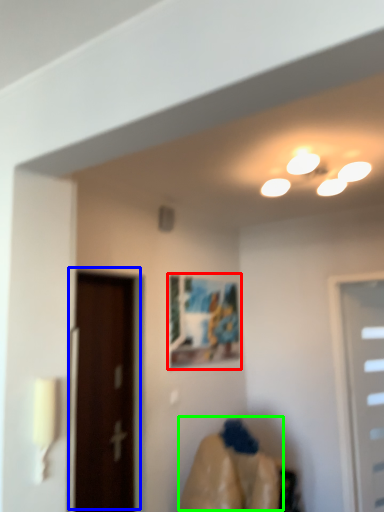
Question: Which object is the closest to the picture frame (highlighted by a red box)? Choose among these: door (highlighted by a blue box) or woman (highlighted by a green box).

Choices:
 (A) door
 (B) woman

Answer: (A)